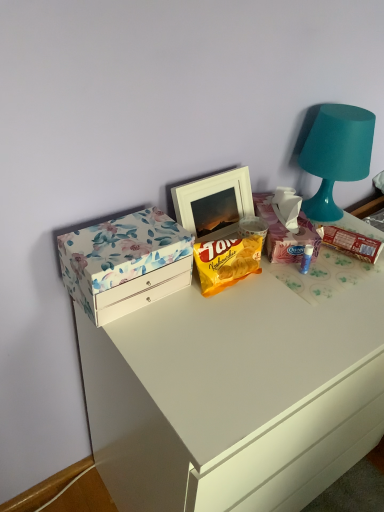
I want to click on vacant space to the right of floral paper box at left, so click(x=218, y=315).